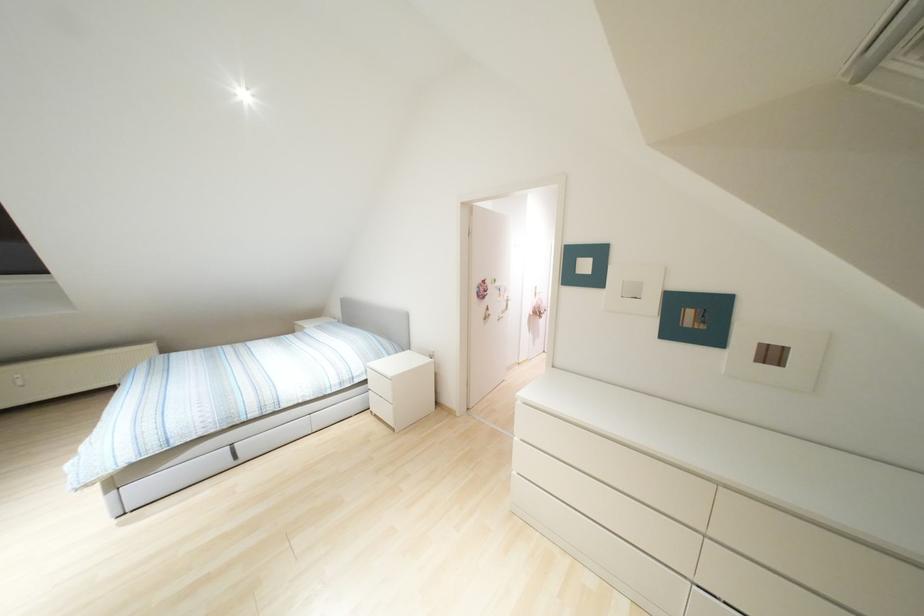
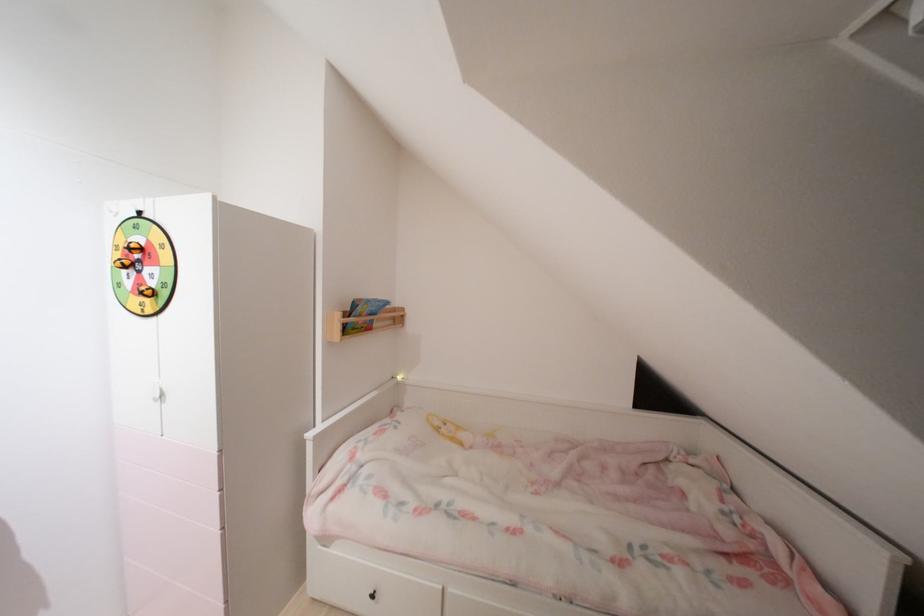
What movement of the cameraman would produce the second image?

The cameraman walked toward right, forward.